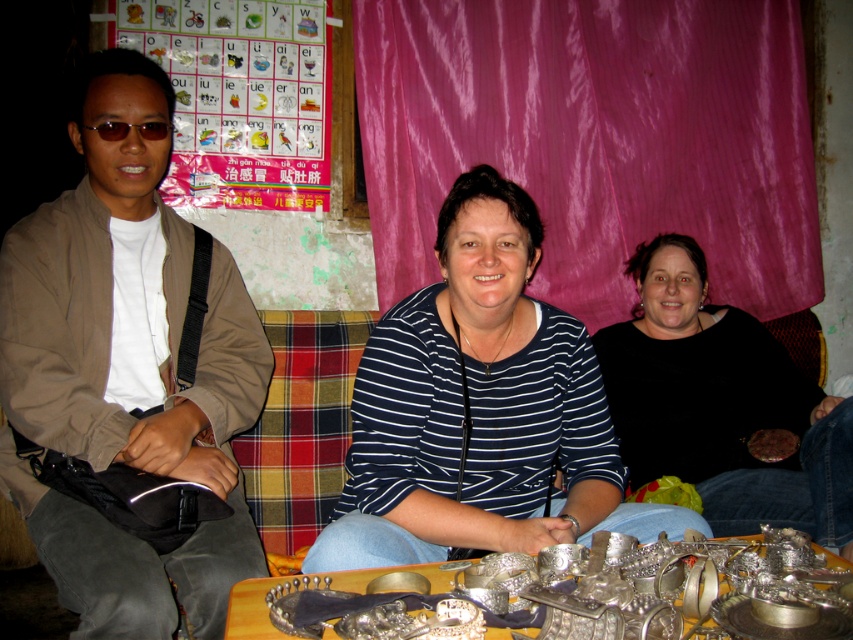
Question: Estimate the real-world distances between objects in this image. Which object is farther from the metallic silver jewelry at lower center?

Choices:
 (A) brown fabric jacket at left
 (B) black matte shirt at center

Answer: (B)

Question: Does blue striped shirt at center appear on the left side of metallic silver jewelry at lower center?

Choices:
 (A) no
 (B) yes

Answer: (A)

Question: In this image, where is brown fabric jacket at left located relative to black matte shirt at center?

Choices:
 (A) above
 (B) below

Answer: (A)

Question: Which object is positioned closest to the black matte shirt at center?

Choices:
 (A) metallic silver jewelry at lower center
 (B) brown fabric jacket at left

Answer: (A)

Question: Does blue striped shirt at center have a greater width compared to black matte shirt at center?

Choices:
 (A) yes
 (B) no

Answer: (A)

Question: Estimate the real-world distances between objects in this image. Which object is closer to the metallic silver jewelry at lower center?

Choices:
 (A) blue striped shirt at center
 (B) brown fabric jacket at left
 (C) black matte shirt at center

Answer: (A)